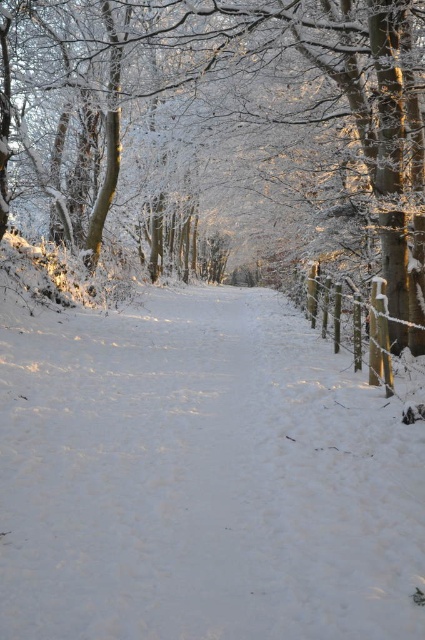
Between white snow at center and white frosty tree at center, which one appears on the right side from the viewer's perspective?

Positioned to the right is white snow at center.

Can you confirm if white snow at center is wider than white frosty tree at center?

No, white snow at center is not wider than white frosty tree at center.

Which is behind, point (181, 483) or point (346, 154)?

Positioned behind is point (346, 154).

You are a GUI agent. You are given a task and a screenshot of the screen. Output one action in this format:
    pyautogui.click(x=<x>, y=<y>)
    Task: Click on the white snow at center
    
    Given the screenshot: What is the action you would take?
    pyautogui.click(x=201, y=477)

Who is higher up, white snow at center or wooden fence at right?

Positioned higher is wooden fence at right.

Between white snow at center and wooden fence at right, which one has more height?

white snow at center is taller.

This screenshot has height=640, width=425. Describe the element at coordinates (201, 477) in the screenshot. I see `white snow at center` at that location.

This screenshot has width=425, height=640. I want to click on white snow at center, so click(x=201, y=477).

Is white frosty tree at center to the left of wooden fence at right from the viewer's perspective?

Correct, you'll find white frosty tree at center to the left of wooden fence at right.

Who is taller, white frosty tree at center or wooden fence at right?

white frosty tree at center

I want to click on white frosty tree at center, so click(x=223, y=134).